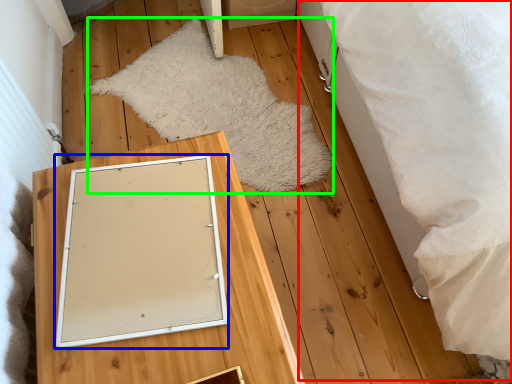
Question: Which object is the farthest from bed (highlighted by a red box)? Choose among these: picture frame (highlighted by a blue box) or blanket (highlighted by a green box).

Choices:
 (A) picture frame
 (B) blanket

Answer: (A)